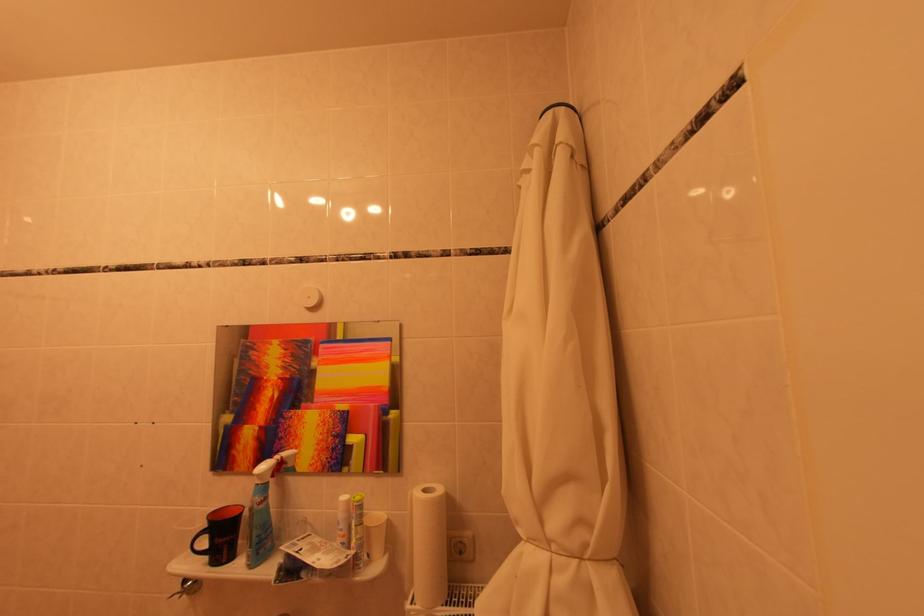
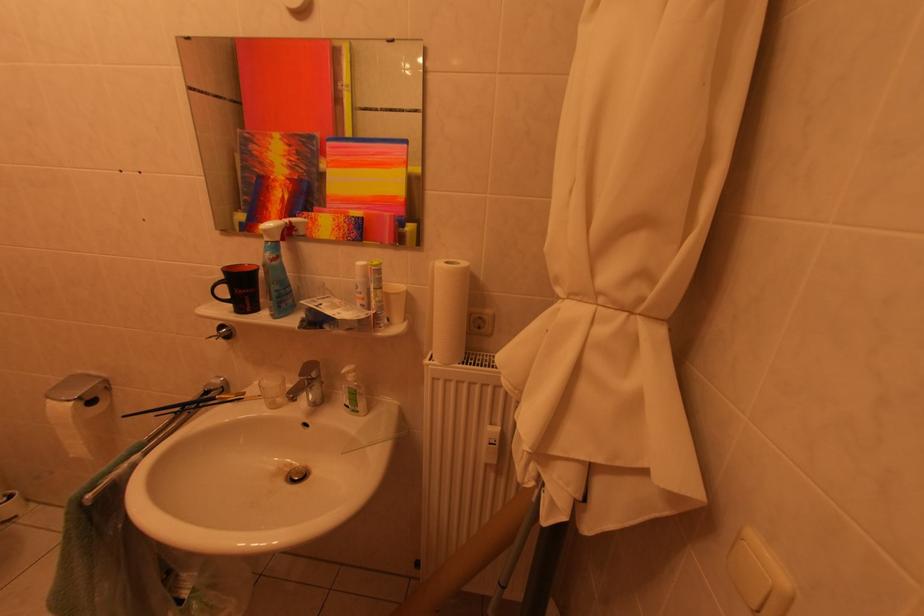
Question: Which direction would the cameraman need to move to produce the second image? Reply with the corresponding letter.

Choices:
 (A) Left
 (B) Right
 (C) Forward
 (D) Backward

Answer: (C)